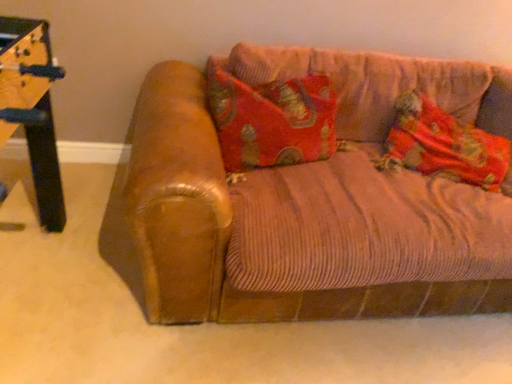
Question: Considering the relative positions of brown leather couch at center and velvet-like fabric pillow at right in the image provided, is brown leather couch at center to the left of velvet-like fabric pillow at right from the viewer's perspective?

Choices:
 (A) no
 (B) yes

Answer: (B)

Question: Can you confirm if brown leather couch at center is positioned to the right of velvet-like fabric pillow at right?

Choices:
 (A) no
 (B) yes

Answer: (A)

Question: Considering the relative positions of brown leather couch at center and velvet-like fabric pillow at right in the image provided, is brown leather couch at center in front of velvet-like fabric pillow at right?

Choices:
 (A) yes
 (B) no

Answer: (A)

Question: Is brown leather couch at center wider than velvet-like fabric pillow at right?

Choices:
 (A) yes
 (B) no

Answer: (A)

Question: Does brown leather couch at center turn towards velvet-like fabric pillow at right?

Choices:
 (A) no
 (B) yes

Answer: (B)

Question: Does brown leather couch at center have a larger size compared to velvet-like fabric pillow at right?

Choices:
 (A) yes
 (B) no

Answer: (A)

Question: From a real-world perspective, is velvet-like fabric pillow at right below brown leather couch at center?

Choices:
 (A) yes
 (B) no

Answer: (B)

Question: Considering the relative sizes of velvet-like fabric pillow at right and brown leather couch at center in the image provided, is velvet-like fabric pillow at right shorter than brown leather couch at center?

Choices:
 (A) no
 (B) yes

Answer: (B)

Question: From the image's perspective, would you say velvet-like fabric pillow at right is positioned over brown leather couch at center?

Choices:
 (A) yes
 (B) no

Answer: (A)

Question: Does velvet-like fabric pillow at right come in front of brown leather couch at center?

Choices:
 (A) yes
 (B) no

Answer: (B)

Question: Does velvet-like fabric pillow at right lie behind brown leather couch at center?

Choices:
 (A) yes
 (B) no

Answer: (A)

Question: Is velvet-like fabric pillow at right thinner than brown leather couch at center?

Choices:
 (A) yes
 (B) no

Answer: (A)

Question: In terms of height, does brown leather couch at center look taller or shorter compared to velvet-like fabric pillow at right?

Choices:
 (A) short
 (B) tall

Answer: (B)